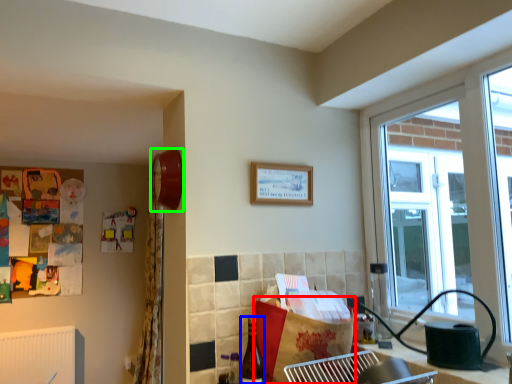
Question: Which object is the closest to the cardboard box (highlighted by a red box)? Choose among these: bottle (highlighted by a blue box) or clock (highlighted by a green box).

Choices:
 (A) bottle
 (B) clock

Answer: (A)